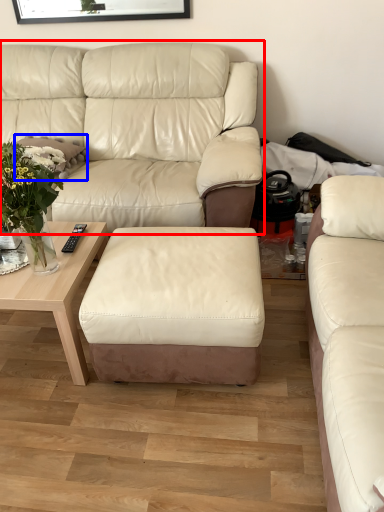
Question: Which of the following is the closest to the observer, studio couch (highlighted by a red box) or pillow (highlighted by a blue box)?

Choices:
 (A) studio couch
 (B) pillow

Answer: (A)